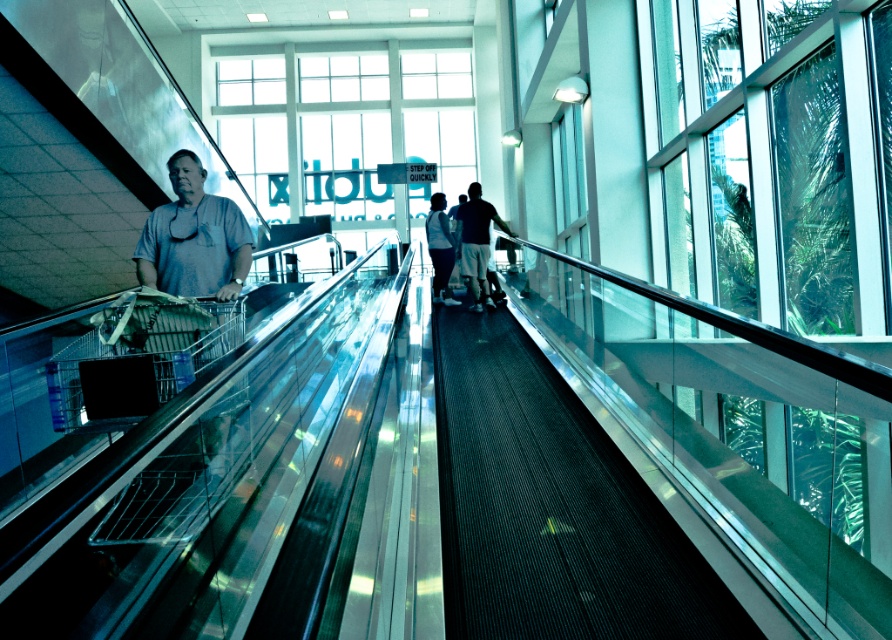
You are standing on the moving walkway and need to pass through the crowd. Which of the two people at the center, the gray matte shirt at center or the dark blue shorts at center, would you have an easier time moving around due to their body size?

The gray matte shirt at center is thinner than the dark blue shorts at center, so you would have an easier time moving around the gray matte shirt at center.

You are standing on the moving walkway and need to decide whether to pass the gray matte shirt at center or the light blue jeans at center. Based on their sizes, which one would be easier to pass?

The gray matte shirt at center has a smaller size compared to the light blue jeans at center, so it would be easier to pass the gray matte shirt at center because it takes up less space.

You are standing on the moving walkway and want to greet the gray matte shirt at center and dark blue shorts at center. Which one should you approach first as they move forward?

You should approach the gray matte shirt at center first because it is closer to you than the dark blue shorts at center, so it will pass by you sooner as the walkway moves forward.